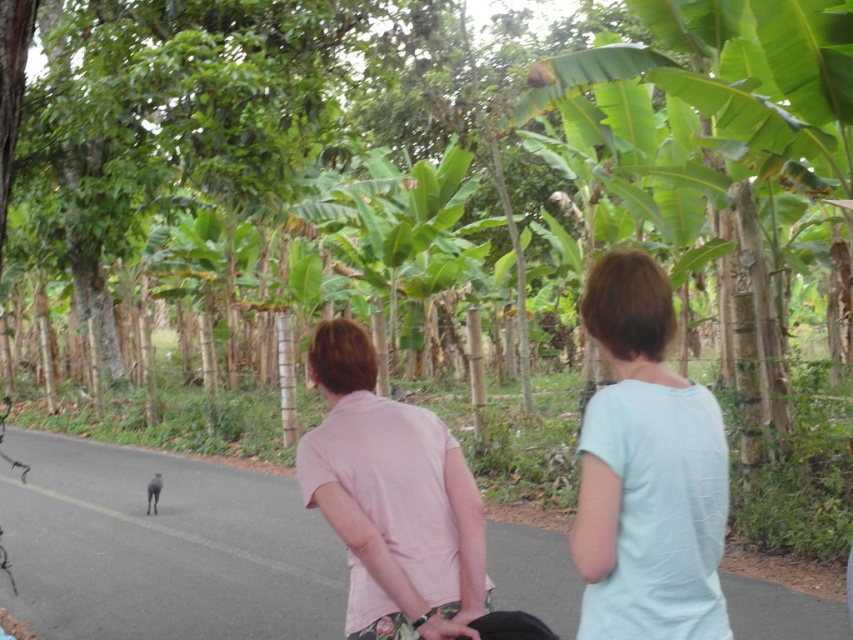
Question: Does light blue cotton shirt at center appear on the left side of pink cotton shirt at center?

Choices:
 (A) no
 (B) yes

Answer: (A)

Question: Estimate the real-world distances between objects in this image. Which object is farther from the pink cotton shirt at center?

Choices:
 (A) light blue cotton shirt at center
 (B) smooth skin hand at center

Answer: (A)

Question: Which of these objects is positioned farthest from the smooth skin hand at center?

Choices:
 (A) pink cotton shirt at center
 (B) light blue cotton shirt at center

Answer: (B)

Question: Which of the following is the farthest from the observer?

Choices:
 (A) (364, 483)
 (B) (422, 637)
 (C) (612, 440)

Answer: (A)

Question: Is light blue cotton shirt at center smaller than pink cotton shirt at center?

Choices:
 (A) yes
 (B) no

Answer: (A)

Question: Does light blue cotton shirt at center lie in front of pink cotton shirt at center?

Choices:
 (A) yes
 (B) no

Answer: (A)